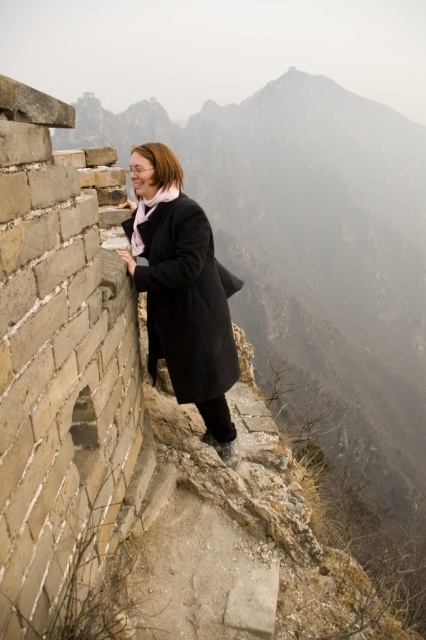
Question: From the image, what is the correct spatial relationship of gray stone wall at left in relation to matte black coat at left?

Choices:
 (A) right
 (B) left

Answer: (A)

Question: Is gray stone wall at left bigger than matte black coat at left?

Choices:
 (A) no
 (B) yes

Answer: (B)

Question: Considering the relative positions of gray stone wall at left and matte black coat at left in the image provided, where is gray stone wall at left located with respect to matte black coat at left?

Choices:
 (A) below
 (B) above

Answer: (B)

Question: Among these points, which one is nearest to the camera?

Choices:
 (A) (316, 332)
 (B) (238, 284)

Answer: (B)

Question: Among these points, which one is farthest from the camera?

Choices:
 (A) (164, 179)
 (B) (94, 116)

Answer: (B)

Question: Which object appears closest to the camera in this image?

Choices:
 (A) matte black coat at left
 (B) gray stone wall at left

Answer: (A)